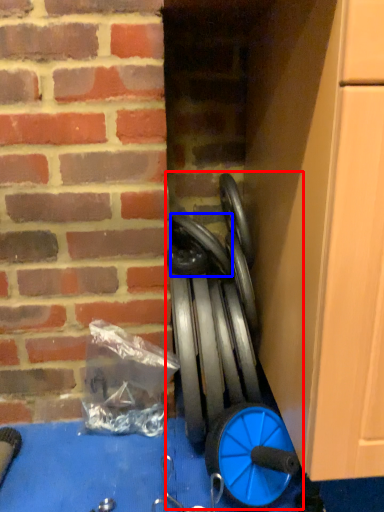
Question: Which object appears farthest to the camera in this image, sport equipment (highlighted by a red box) or car tire (highlighted by a blue box)?

Choices:
 (A) sport equipment
 (B) car tire

Answer: (B)